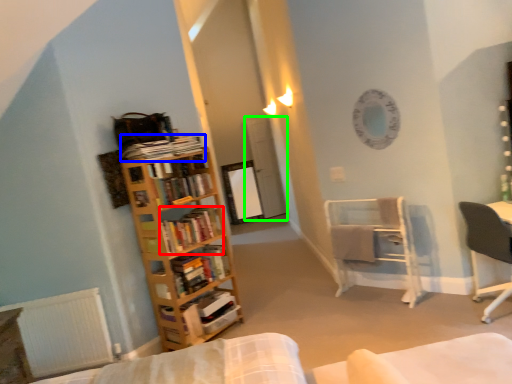
Question: Considering the real-world distances, which object is farthest from book (highlighted by a red box)? book (highlighted by a blue box) or glass door (highlighted by a green box)?

Choices:
 (A) book
 (B) glass door

Answer: (B)